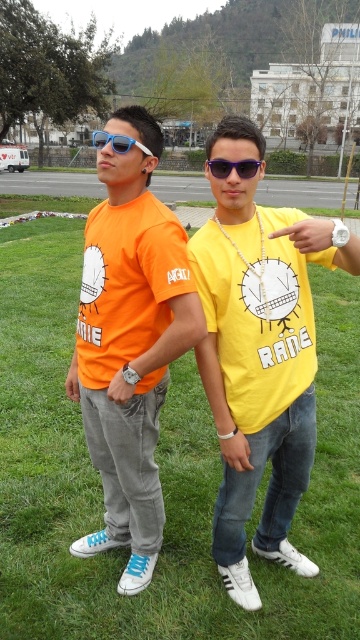
You are standing at the point with coordinates point [91,304] and want to walk to the road in the background. Is the point with coordinates point [236,412] blocking your path?

Point [236,412] is in front of point [91,304], so yes, the point with coordinates point [236,412] is blocking your path.

You are a photographer trying to adjust the focus of your camera. The camera has a focus point at coordinates 0.55, 0.72. Is the yellow matte shirt at center located near that focus point?

Yes, the yellow matte shirt at center is located at point (259, 353), which is very close to the camera focus point at (259, 352), so it is near the focus point.